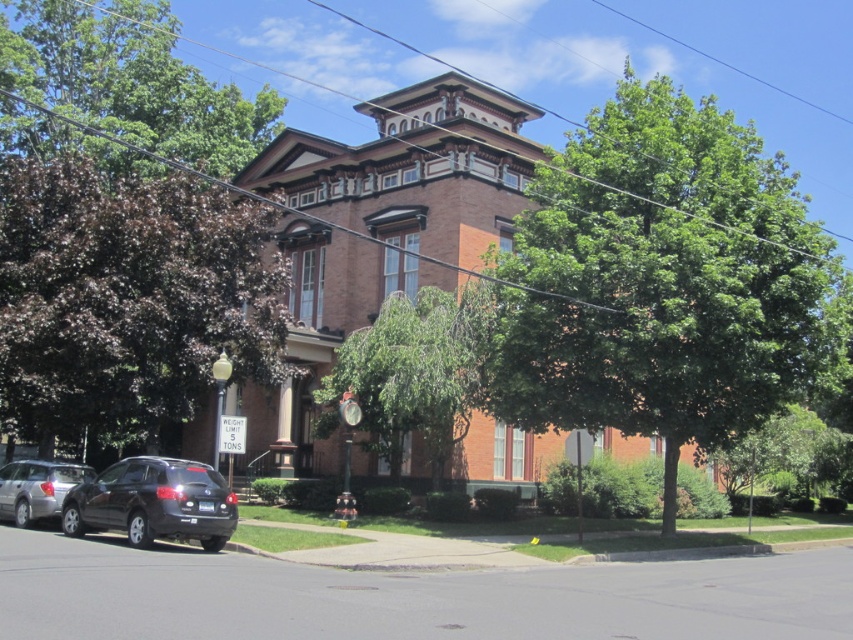
Question: Estimate the real-world distances between objects in this image. Which object is farther from the purple-leaved tree at left?

Choices:
 (A) green leafy tree at upper left
 (B) shiny black suv at lower left
 (C) green leafy tree at upper center

Answer: (A)

Question: Which point appears closest to the camera in this image?

Choices:
 (A) (404, 401)
 (B) (784, 236)

Answer: (B)

Question: Considering the real-world distances, which object is farthest from the silver metallic car at lower left?

Choices:
 (A) green leafy tree at center
 (B) green leafy tree at upper center
 (C) green leafy tree at upper left

Answer: (C)

Question: In this image, where is purple-leaved tree at left located relative to shiny black suv at lower left?

Choices:
 (A) below
 (B) above

Answer: (B)

Question: Does green leafy tree at upper center appear over green leafy tree at center?

Choices:
 (A) no
 (B) yes

Answer: (B)

Question: Can you confirm if green leafy tree at upper center is positioned to the left of silver metallic car at lower left?

Choices:
 (A) yes
 (B) no

Answer: (B)